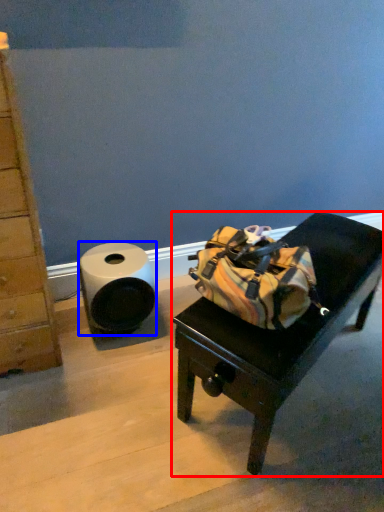
Question: Which point is closer to the camera, furniture (highlighted by a red box) or toilet paper (highlighted by a blue box)?

Choices:
 (A) furniture
 (B) toilet paper

Answer: (A)